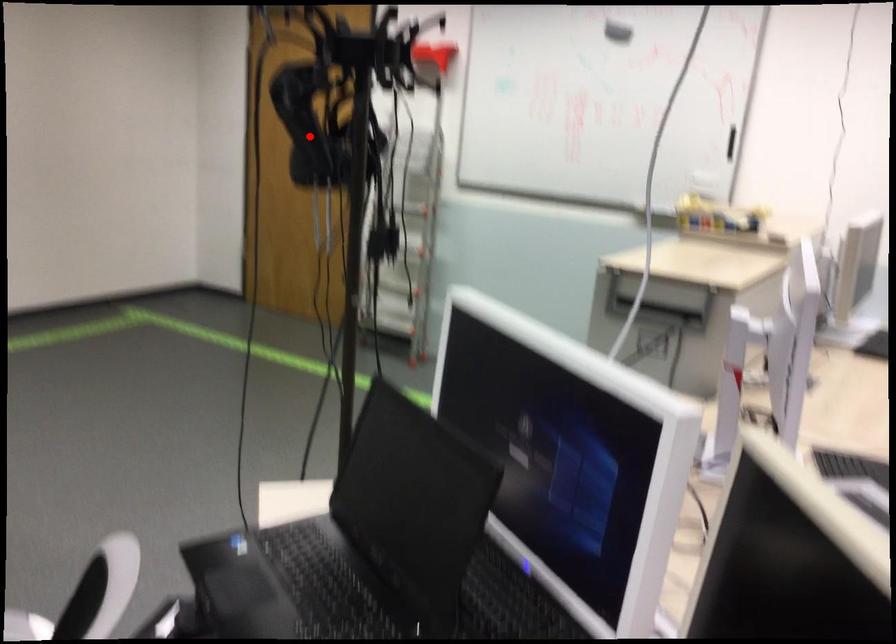
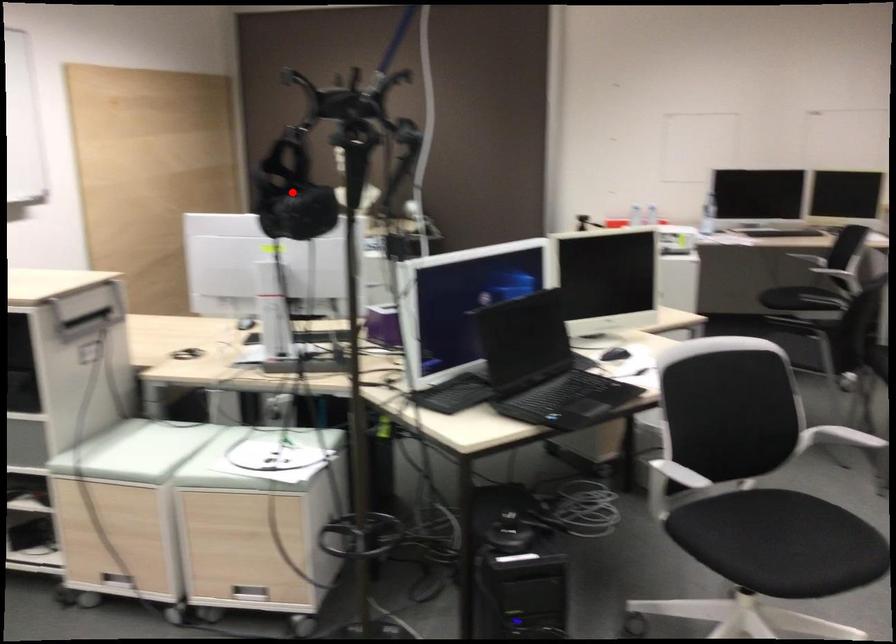
I am providing you with two images of the same scene from different viewpoints. A red point is marked on the first image and another point is marked on the second image. Is the marked point in image1 the same physical position as the marked point in image2?

Yes